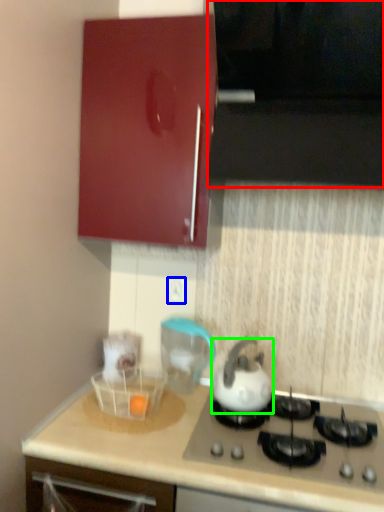
Question: Which is nearer to the vent (highlighted by a red box)? electric outlet (highlighted by a blue box) or kettle (highlighted by a green box).

Choices:
 (A) electric outlet
 (B) kettle

Answer: (B)